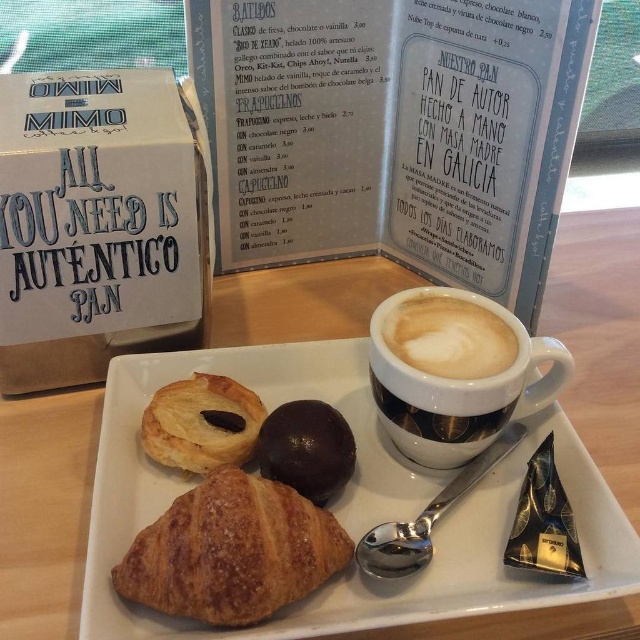
Question: Considering the real-world distances, which object is closest to the matte ceramic cup at center?

Choices:
 (A) golden brown flaky croissant at lower left
 (B) shiny chocolate truffle at center

Answer: (B)

Question: Is golden flaky pastry at center wider than shiny chocolate truffle at center?

Choices:
 (A) no
 (B) yes

Answer: (B)

Question: Does cappuccino foam at center have a smaller size compared to shiny chocolate truffle at center?

Choices:
 (A) no
 (B) yes

Answer: (A)

Question: Which of the following is the farthest from the observer?

Choices:
 (A) (525, 595)
 (B) (424, 392)
 (C) (61, 204)
 (D) (342, 419)

Answer: (D)

Question: Does golden brown croissant at center have a greater width compared to white cardboard box at upper left?

Choices:
 (A) yes
 (B) no

Answer: (A)

Question: Which of these objects is positioned farthest from the white cardboard box at upper left?

Choices:
 (A) golden brown croissant at center
 (B) shiny chocolate truffle at center
 (C) cappuccino foam at center

Answer: (C)